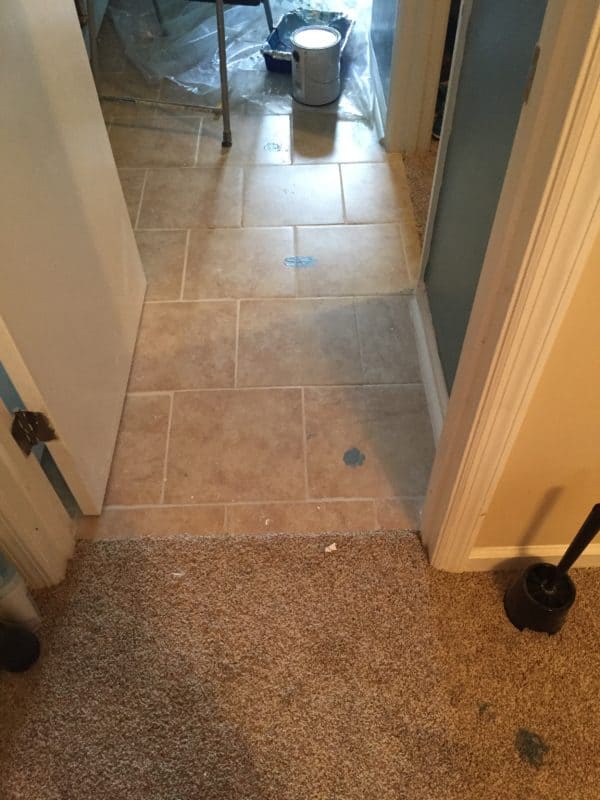
Image resolution: width=600 pixels, height=800 pixels. In order to click on toilet brush black in this screenshot , I will do `click(549, 606)`.